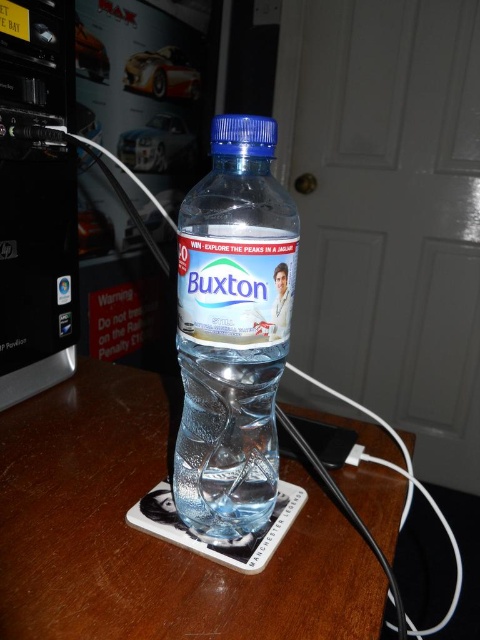
Question: Does clear wood coaster at center appear on the left side of clear plastic bottle at center?

Choices:
 (A) no
 (B) yes

Answer: (B)

Question: Which point is farther to the camera?

Choices:
 (A) clear wood coaster at center
 (B) clear plastic bottle at center

Answer: (B)

Question: Is clear wood coaster at center below clear plastic bottle at center?

Choices:
 (A) no
 (B) yes

Answer: (B)

Question: From the image, what is the correct spatial relationship of clear wood coaster at center in relation to clear plastic bottle at center?

Choices:
 (A) left
 (B) right

Answer: (A)

Question: Which point appears farthest from the camera in this image?

Choices:
 (A) (288, 460)
 (B) (275, 392)

Answer: (A)